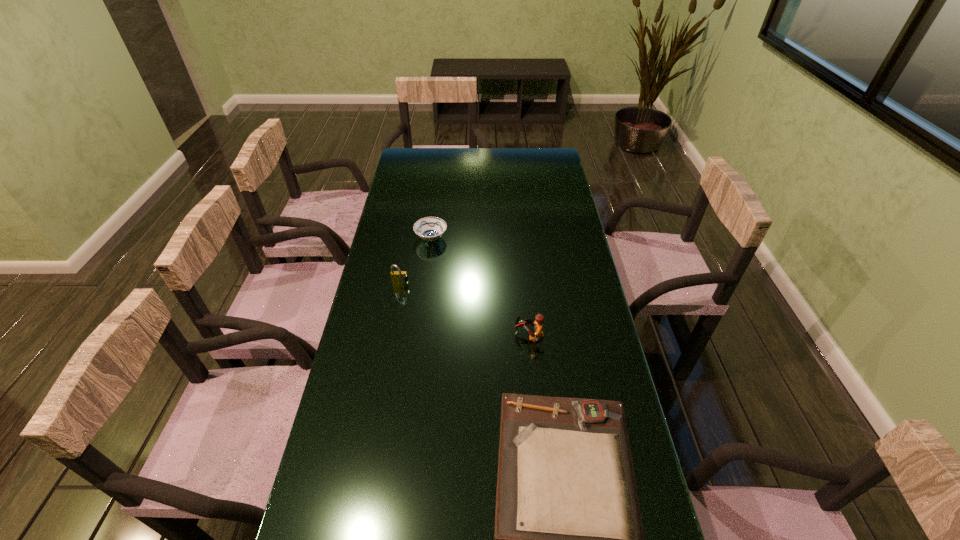
Locate an element on the screen. soup bowl at the left edge is located at coordinates (429, 228).

Locate an element on the screen. vacant space at the far edge is located at coordinates (461, 151).

I want to click on free space at the left edge of the desktop, so click(x=425, y=207).

Identify the location of free point at the right edge. (550, 195).

Where is `vacant area at the far left corner of the desktop`? Image resolution: width=960 pixels, height=540 pixels. vacant area at the far left corner of the desktop is located at coordinates (417, 172).

What are the coordinates of `free space that is in between the Lego and the padlock` in the screenshot? It's located at (465, 310).

Where is `vacant space that's between the Lego and the second shortest object`? vacant space that's between the Lego and the second shortest object is located at coordinates (480, 287).

Locate an element on the screen. The image size is (960, 540). vacant region between the second shortest object and the padlock is located at coordinates (416, 261).

The width and height of the screenshot is (960, 540). Find the location of `unoccupied position between the padlock and the Lego`. unoccupied position between the padlock and the Lego is located at coordinates tap(465, 310).

Where is `free space between the soup bowl and the padlock`? free space between the soup bowl and the padlock is located at coordinates coord(416,261).